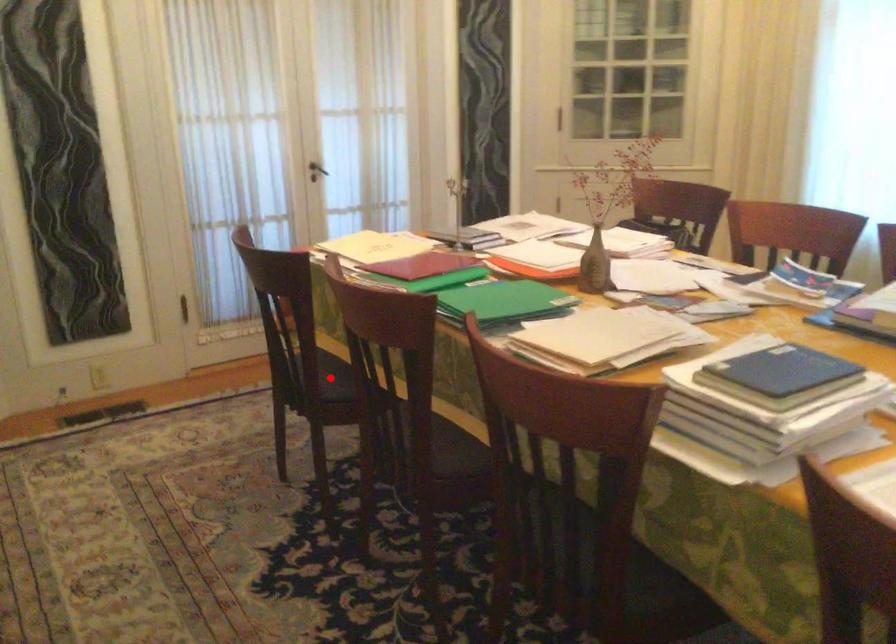
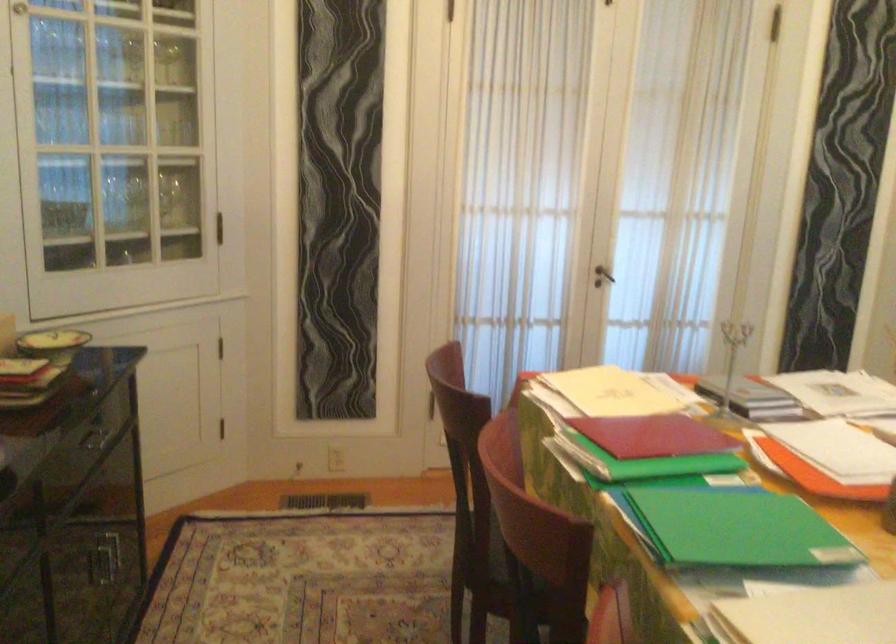
Question: I am providing you with two images of the same scene from different viewpoints. A red point is marked on the first image. Can you still see the location of the red point in image 2?

Choices:
 (A) Yes
 (B) No

Answer: (B)